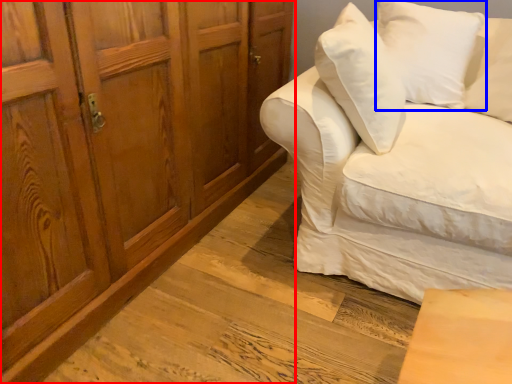
Question: Among these objects, which one is nearest to the camera, cabinetry (highlighted by a red box) or pillow (highlighted by a blue box)?

Choices:
 (A) cabinetry
 (B) pillow

Answer: (A)